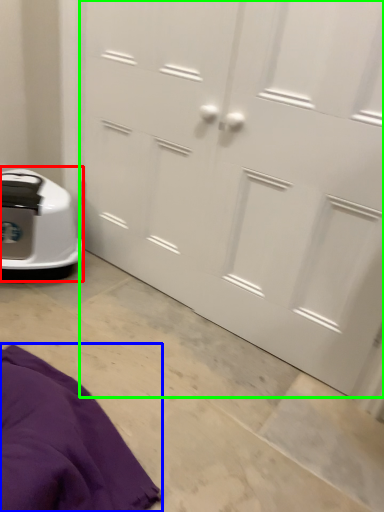
Question: Considering the real-world distances, which object is closest to home appliance (highlighted by a red box)? blanket (highlighted by a blue box) or door (highlighted by a green box).

Choices:
 (A) blanket
 (B) door

Answer: (B)